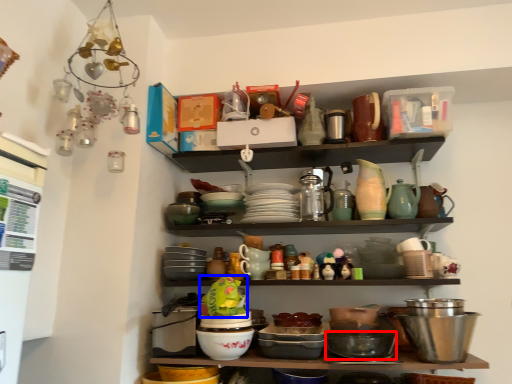
Question: Which of the following is the closest to the observer, bowl (highlighted by a red box) or food (highlighted by a blue box)?

Choices:
 (A) bowl
 (B) food

Answer: (B)